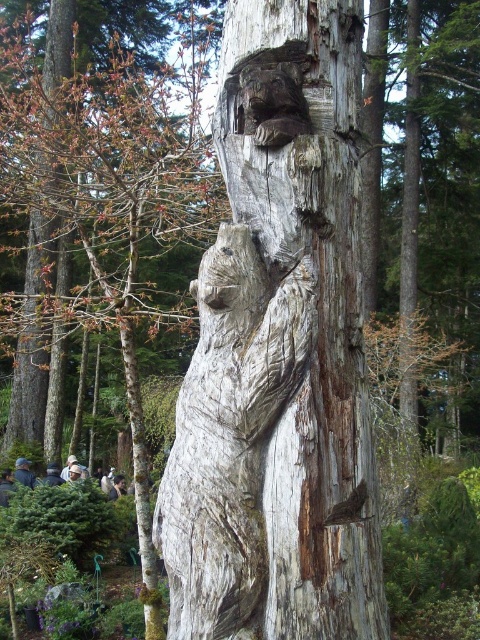
Between point (259, 93) and point (226, 400), which one is positioned in front?

Point (226, 400)

Does weathered wood carving at center have a greater width compared to gray wood bear at center?

Yes.

Which is in front, point (379, 572) or point (252, 580)?

Positioned in front is point (252, 580).

Where is `weathered wood carving at center`? This screenshot has width=480, height=640. weathered wood carving at center is located at coordinates (307, 307).